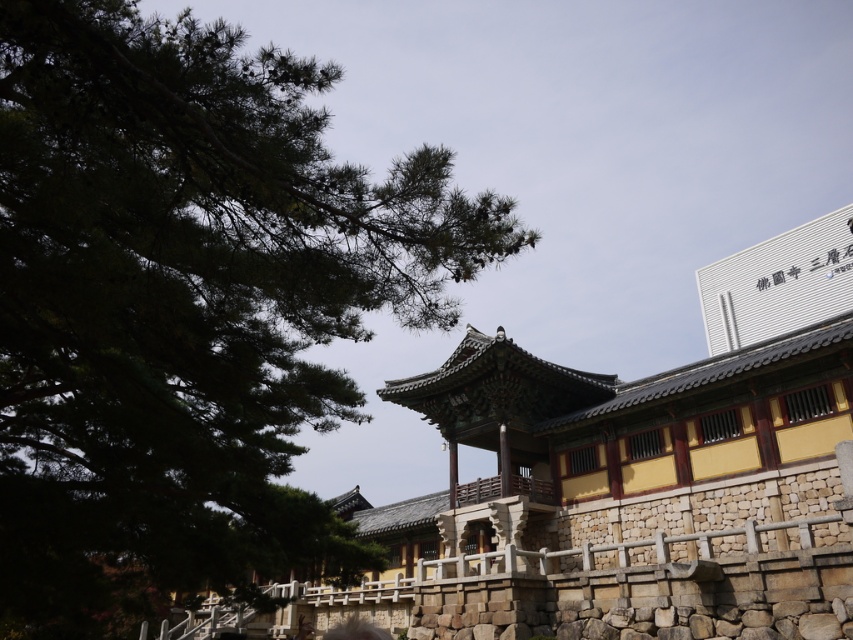
Can you confirm if green leafy tree at upper left is taller than smooth stone face at center?

Correct, green leafy tree at upper left is much taller as smooth stone face at center.

This screenshot has width=853, height=640. What do you see at coordinates (186, 307) in the screenshot?
I see `green leafy tree at upper left` at bounding box center [186, 307].

Identify the location of green leafy tree at upper left. This screenshot has height=640, width=853. (186, 307).